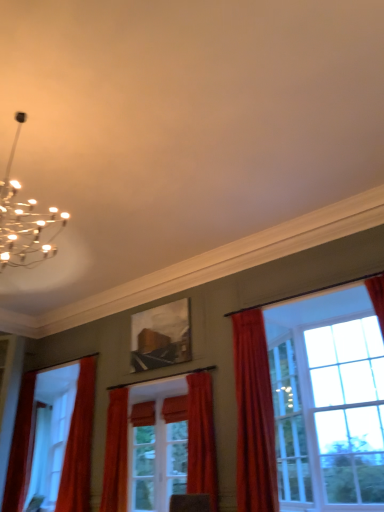
Question: From a real-world perspective, is clear glass screen door at center above or below matte wooden picture frame at center?

Choices:
 (A) above
 (B) below

Answer: (B)

Question: Considering the positions of clear glass screen door at center and matte wooden picture frame at center in the image, is clear glass screen door at center taller or shorter than matte wooden picture frame at center?

Choices:
 (A) short
 (B) tall

Answer: (B)

Question: Which object is the closest to the matte red curtain at left, the first curtain from the left?

Choices:
 (A) velvet red curtain at center, positioned as the 4th curtain in left-to-right order
 (B) matte wooden picture frame at center
 (C) matte orange curtain at center, which is the 3th curtain from left to right
 (D) clear glass window at right
 (E) orange velvet curtain at left, which is counted as the 4th curtain, starting from the right

Answer: (E)

Question: Which object is the farthest from the clear glass screen door at center?

Choices:
 (A) clear glass window at right
 (B) matte orange curtain at center, which is the 3th curtain from left to right
 (C) orange velvet curtain at left, the second curtain in the left-to-right sequence
 (D) velvet red curtain at right, which is counted as the 5th curtain, starting from the left
 (E) velvet red curtain at center, positioned as the 4th curtain in left-to-right order

Answer: (A)